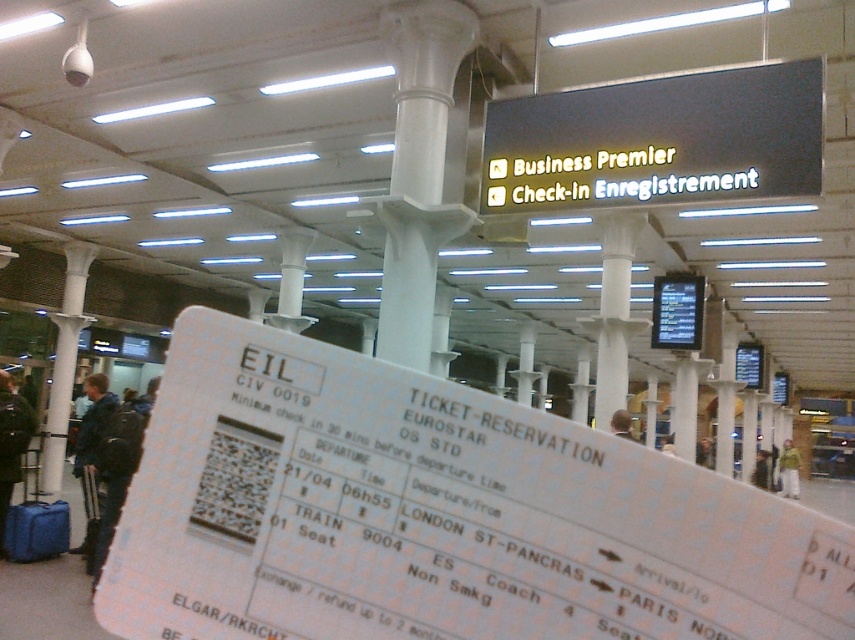
You are a traveler at the train station and you need to decide which jacket to wear for your trip. You see the dark blue jacket at left and the green fuzzy jacket at lower right. Which jacket is wider?

The green fuzzy jacket at lower right is wider than the dark blue jacket at left.

You are a traveler standing in the train station and you see the green fuzzy jacket at lower right and the light brown leather jacket at lower right. Which jacket is closer to you?

The green fuzzy jacket at lower right is closer to you because the light brown leather jacket at lower right is behind it.

You are standing in the train station and see the light brown leather jacket at lower right. Where exactly is it located in terms of coordinates?

The light brown leather jacket at lower right is located at coordinates point (761, 470).